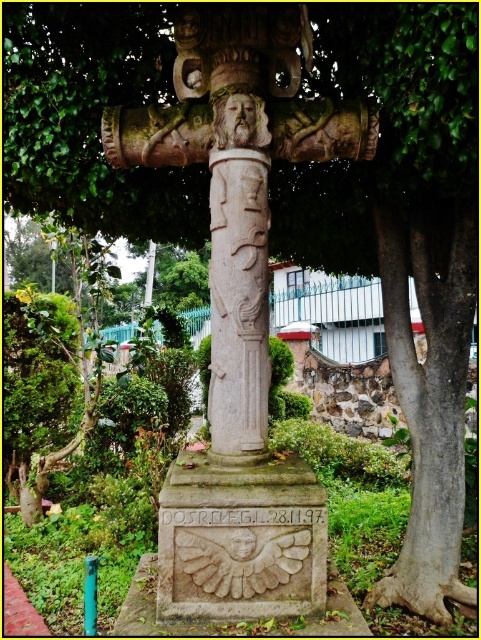
Question: Among these points, which one is nearest to the camera?

Choices:
 (A) (250, 385)
 (B) (291, 129)

Answer: (A)

Question: Is carved stone column at center positioned before white stone column at center?

Choices:
 (A) yes
 (B) no

Answer: (B)

Question: Among these objects, which one is farthest from the camera?

Choices:
 (A) carved stone column at center
 (B) white stone column at center

Answer: (A)

Question: Among these objects, which one is farthest from the camera?

Choices:
 (A) carved stone column at center
 (B) white stone column at center

Answer: (A)

Question: Is carved stone column at center above white stone column at center?

Choices:
 (A) yes
 (B) no

Answer: (A)

Question: Does carved stone column at center appear on the left side of white stone column at center?

Choices:
 (A) no
 (B) yes

Answer: (A)